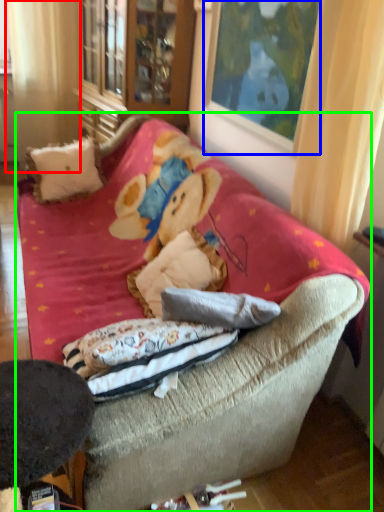
Question: Based on their relative distances, which object is nearer to curtain (highlighted by a red box)? Choose from picture frame (highlighted by a blue box) and studio couch (highlighted by a green box).

Choices:
 (A) picture frame
 (B) studio couch

Answer: (B)